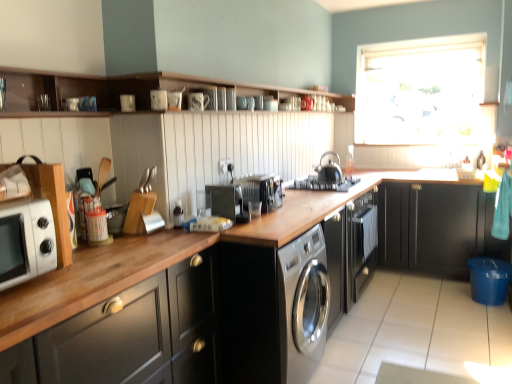
Question: Would you say white glossy microwave at left contains satin black stove at center?

Choices:
 (A) no
 (B) yes

Answer: (A)

Question: Is white glossy microwave at left bigger than satin black stove at center?

Choices:
 (A) no
 (B) yes

Answer: (A)

Question: From the image's perspective, is white glossy microwave at left beneath satin black stove at center?

Choices:
 (A) yes
 (B) no

Answer: (A)

Question: Is white glossy microwave at left positioned far away from satin black stove at center?

Choices:
 (A) no
 (B) yes

Answer: (B)

Question: Is the depth of white glossy microwave at left greater than that of satin black stove at center?

Choices:
 (A) yes
 (B) no

Answer: (B)

Question: Is satin black stove at center situated inside white sheer curtain at upper right or outside?

Choices:
 (A) outside
 (B) inside

Answer: (A)

Question: Is point (310, 175) positioned closer to the camera than point (437, 61)?

Choices:
 (A) closer
 (B) farther

Answer: (A)

Question: Considering the positions of satin black stove at center and white sheer curtain at upper right in the image, is satin black stove at center bigger or smaller than white sheer curtain at upper right?

Choices:
 (A) small
 (B) big

Answer: (A)

Question: From a real-world perspective, relative to white sheer curtain at upper right, is satin black stove at center vertically above or below?

Choices:
 (A) above
 (B) below

Answer: (B)

Question: Is sleek stainless steel washing machine at center wider or thinner than black matte kettle at center, arranged as the third appliance when viewed from the front?

Choices:
 (A) wide
 (B) thin

Answer: (A)

Question: From the image's perspective, is sleek stainless steel washing machine at center positioned above or below black matte kettle at center, arranged as the third appliance when viewed from the front?

Choices:
 (A) above
 (B) below

Answer: (B)

Question: Considering the relative positions of sleek stainless steel washing machine at center and black matte kettle at center, the first appliance positioned from the back, in the image provided, is sleek stainless steel washing machine at center to the left or to the right of black matte kettle at center, the first appliance positioned from the back,?

Choices:
 (A) right
 (B) left

Answer: (B)

Question: Is sleek stainless steel washing machine at center in front of or behind black matte kettle at center, the first appliance positioned from the back, in the image?

Choices:
 (A) front
 (B) behind

Answer: (A)

Question: In the image, is satin silver toaster at center, arranged as the second appliance when viewed from the front, positioned in front of or behind white glossy microwave at left?

Choices:
 (A) behind
 (B) front

Answer: (A)

Question: Which is correct: satin silver toaster at center, which ranks as the second appliance in right-to-left order, is inside white glossy microwave at left, or outside of it?

Choices:
 (A) outside
 (B) inside

Answer: (A)